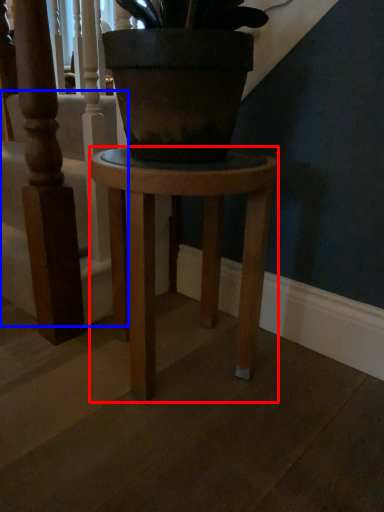
Question: Which object is closer to the camera taking this photo, stool (highlighted by a red box) or stairwell (highlighted by a blue box)?

Choices:
 (A) stool
 (B) stairwell

Answer: (A)